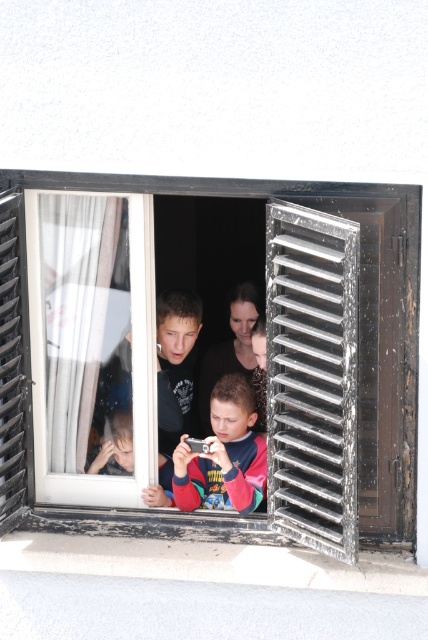
You are an interior designer assessing the space in the image. You need to place a decorative item that must fit between the black matte window at center and the multicolored fabric shirt at center. Given their widths, which object is wider and thus requires more space?

The black matte window at center is wider than the multicolored fabric shirt at center, so it requires more space.

You are an interior designer assessing the room layout. You need to determine if the metallic silver shutter at center can be opened without obstructing the black matte window at center. Based on their positions, what do you conclude?

The metallic silver shutter at center is behind the black matte window at center, so opening it would not obstruct the window since it is positioned behind it.